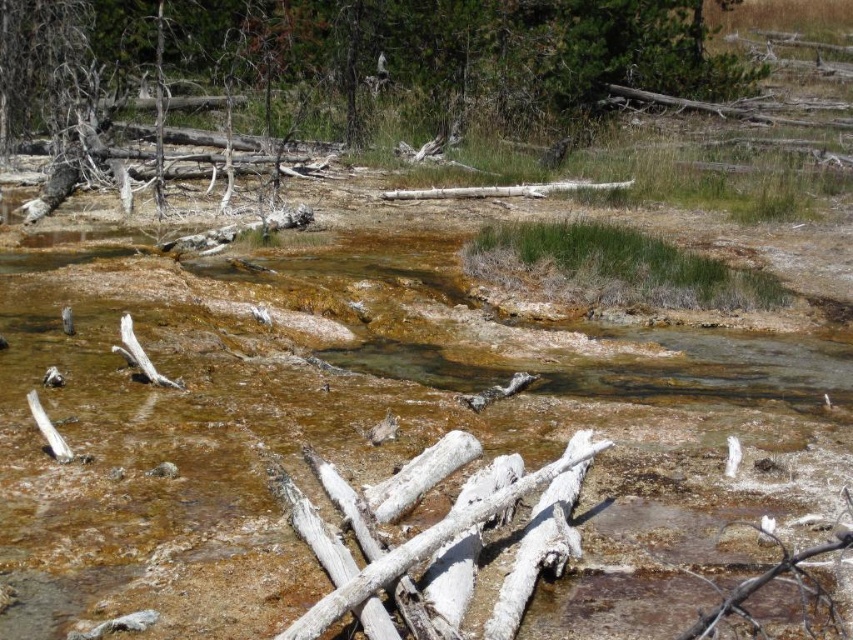
Question: In this image, where is brown sedimentary stream at center located relative to white frosty log at center?

Choices:
 (A) left
 (B) right

Answer: (B)

Question: Is dead wood log at upper center thinner than white frosty log at center?

Choices:
 (A) no
 (B) yes

Answer: (A)

Question: Which point is closer to the camera?

Choices:
 (A) (363, 588)
 (B) (41, 3)
 (C) (12, 564)

Answer: (A)

Question: Which point is farther from the camera taking this photo?

Choices:
 (A) (248, 371)
 (B) (384, 584)

Answer: (A)

Question: Can you confirm if dead wood log at upper center is thinner than white frosty log at center?

Choices:
 (A) no
 (B) yes

Answer: (A)

Question: Which point is farther from the camera taking this photo?

Choices:
 (A) (328, 624)
 (B) (532, 70)
 (C) (628, 630)

Answer: (B)